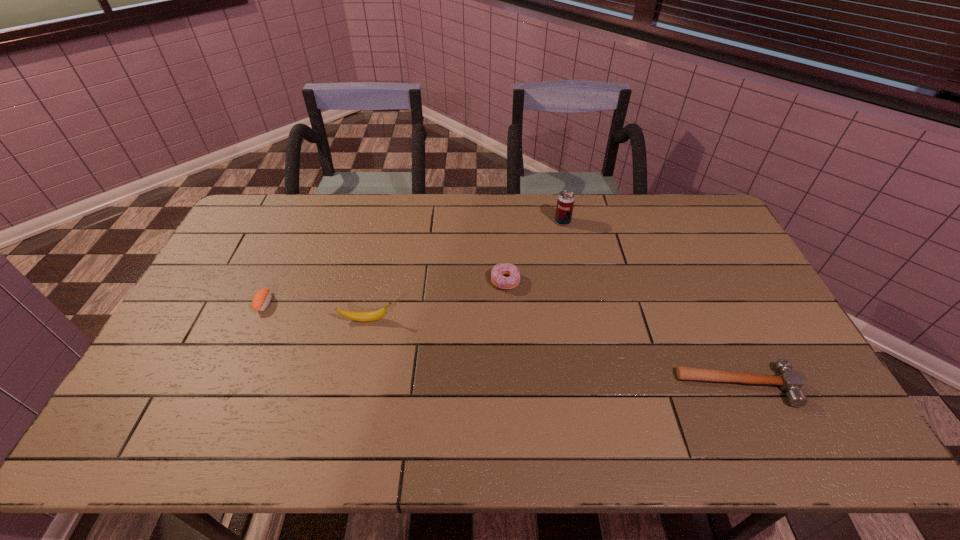
Locate an element on the screen. This screenshot has width=960, height=540. free space between the doughnut and the sushi is located at coordinates (385, 292).

Identify the location of free space between the sushi and the third object from right to left. This screenshot has width=960, height=540. (385, 292).

Locate an element on the screen. The image size is (960, 540). vacant space that's between the hammer and the second nearest object is located at coordinates (552, 353).

I want to click on vacant area between the second object from right to left and the hammer, so click(x=650, y=304).

At what (x,y) coordinates should I click in order to perform the action: click on unoccupied position between the sushi and the second object from right to left. Please return your answer as a coordinate pair (x, y). Looking at the image, I should click on (414, 262).

You are a GUI agent. You are given a task and a screenshot of the screen. Output one action in this format:
    pyautogui.click(x=<x>, y=<y>)
    Task: Click on the vacant area that lies between the sushi and the second object from left to right
    The width and height of the screenshot is (960, 540).
    Given the screenshot: What is the action you would take?
    pyautogui.click(x=316, y=312)

The height and width of the screenshot is (540, 960). I want to click on vacant space that's between the nearest object and the third object from right to left, so click(x=621, y=334).

Locate an element on the screen. blank region between the tallest object and the rightmost object is located at coordinates (650, 304).

Where is `vacant area that lies between the sushi and the hammer`? The image size is (960, 540). vacant area that lies between the sushi and the hammer is located at coordinates (501, 345).

Identify the location of empty location between the hammer and the doughnut. Image resolution: width=960 pixels, height=540 pixels. (621, 334).